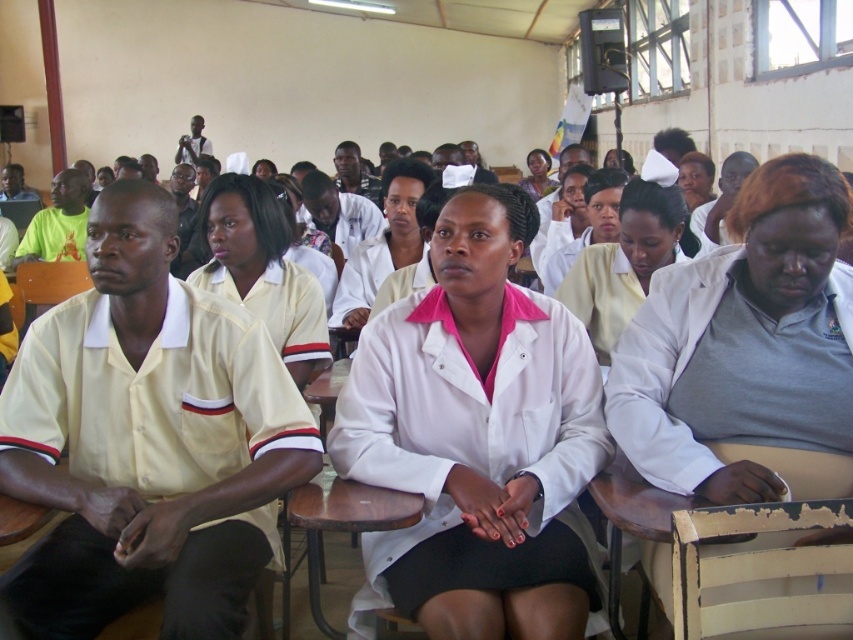
You are standing at the entrance of the classroom and want to hand a note to the person wearing the white smooth shirt at center. Based on their position, can you estimate whether they are sitting in the front row or a row behind?

The white smooth shirt at center is located at point (262,269), which suggests they are sitting in the front row since the coordinates indicate a position closer to the front of the classroom.

You are standing in the classroom and want to reach both the point at coordinates (236,211) and the point at coordinates (651,189). Which point will you reach first as you move forward?

You will reach the point at coordinates (236,211) first because it is closer to you than the point at coordinates (651,189), which is further away.